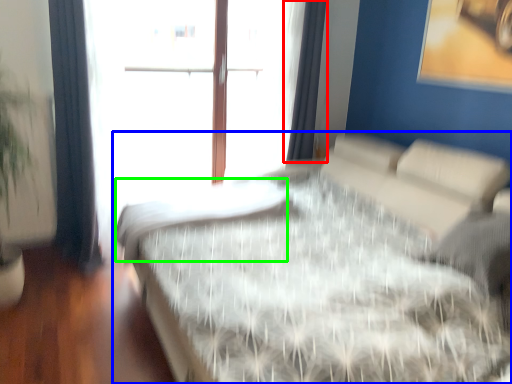
Question: Which is nearer to the curtain (highlighted by a red box)? bed (highlighted by a blue box) or mattress (highlighted by a green box).

Choices:
 (A) bed
 (B) mattress

Answer: (B)